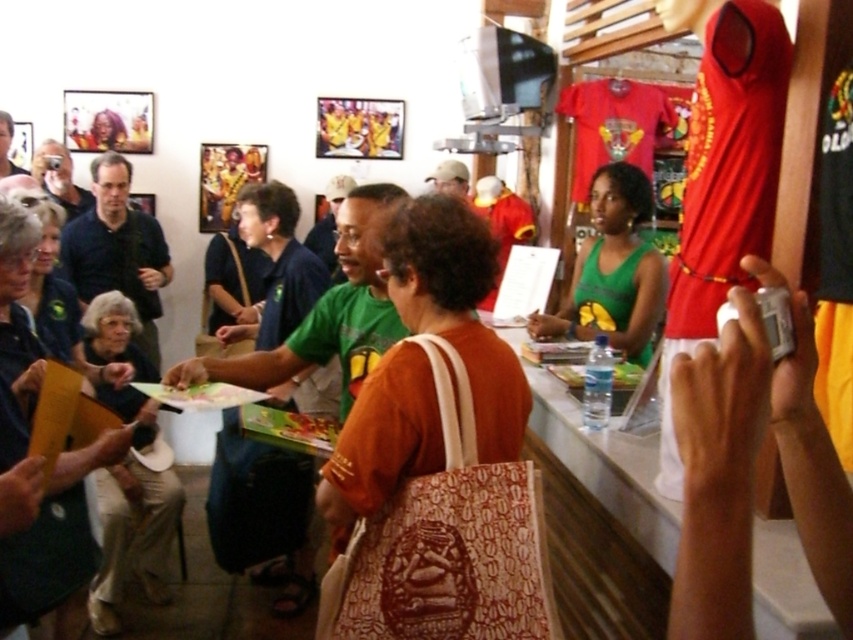
Consider the image. You are a customer in the store and want to take a photo of the mannequin wearing the bright red sports jersey. You notice two points marked in the image at coordinates point (119, 339) and point (79, 336). Which point is closer to your camera lens when taking the photo?

Point (119, 339) is further to the camera than point (79, 336), so the closer point to the camera lens would be point (79, 336).

In the scene shown: You are a shop assistant who needs to place the gray fabric purse at lower left and the matte black camera at upper left into a storage box. The box can only accommodate items that are narrower than 30 cm. Based on their widths, can both items fit inside the box?

The gray fabric purse at lower left might be wider than matte black camera at upper left. Since the purse might exceed 30 cm in width, it may not fit in the box. The camera, being narrower, would likely fit. However, without exact measurements, we can only assume the purse might not fit while the camera probably does.